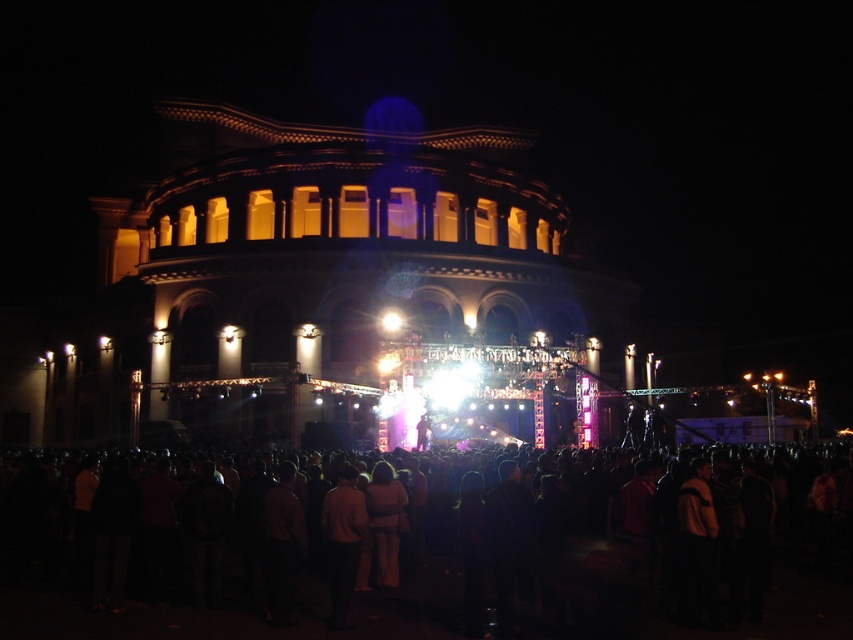
Question: Which point is farther to the camera?

Choices:
 (A) light brown fabric pants at center
 (B) light brown leather jacket at center

Answer: (A)

Question: Can you confirm if dark clothing crowd at lower center is positioned to the right of light brown leather jacket at center?

Choices:
 (A) no
 (B) yes

Answer: (B)

Question: Which point is closer to the camera taking this photo?

Choices:
 (A) (355, 486)
 (B) (381, 522)
 (C) (16, 596)

Answer: (C)

Question: Can you confirm if dark clothing crowd at lower center is wider than light brown fabric pants at center?

Choices:
 (A) yes
 (B) no

Answer: (A)

Question: Is dark clothing crowd at lower center thinner than light brown leather jacket at center?

Choices:
 (A) yes
 (B) no

Answer: (B)

Question: Which of the following is the closest to the observer?

Choices:
 (A) light brown leather jacket at center
 (B) light brown fabric pants at center
 (C) dark clothing crowd at lower center

Answer: (C)